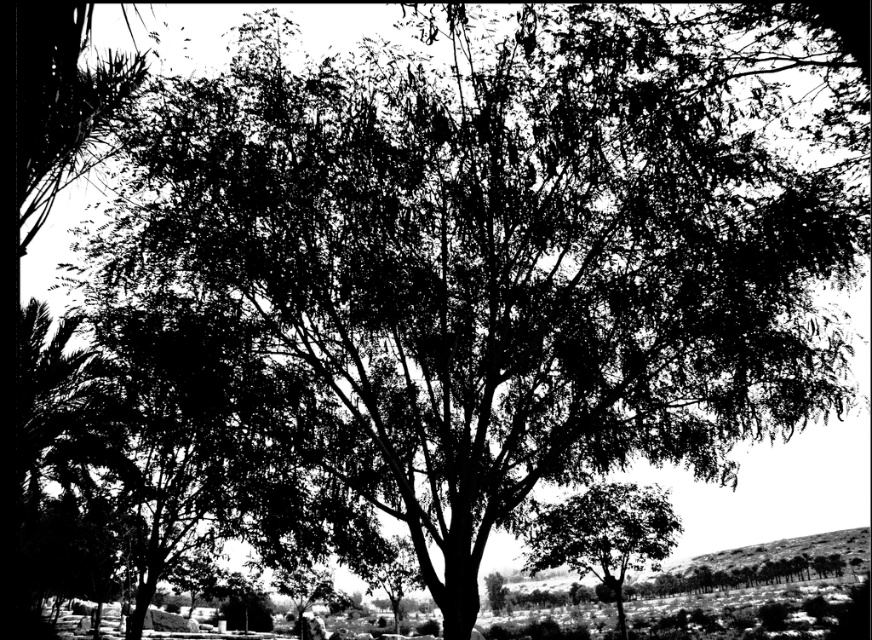
Question: Is smooth green tree at lower right closer to the viewer compared to smooth dirt hillside at lower right?

Choices:
 (A) no
 (B) yes

Answer: (A)

Question: Which of the following is the closest to the observer?

Choices:
 (A) (620, 518)
 (B) (863, 557)

Answer: (B)

Question: Among these points, which one is farthest from the camera?

Choices:
 (A) (755, 552)
 (B) (656, 496)

Answer: (A)

Question: In this image, where is smooth green tree at lower right located relative to smooth dirt hillside at lower right?

Choices:
 (A) above
 (B) below

Answer: (A)

Question: Is smooth green tree at lower right to the left of smooth dirt hillside at lower right from the viewer's perspective?

Choices:
 (A) yes
 (B) no

Answer: (A)